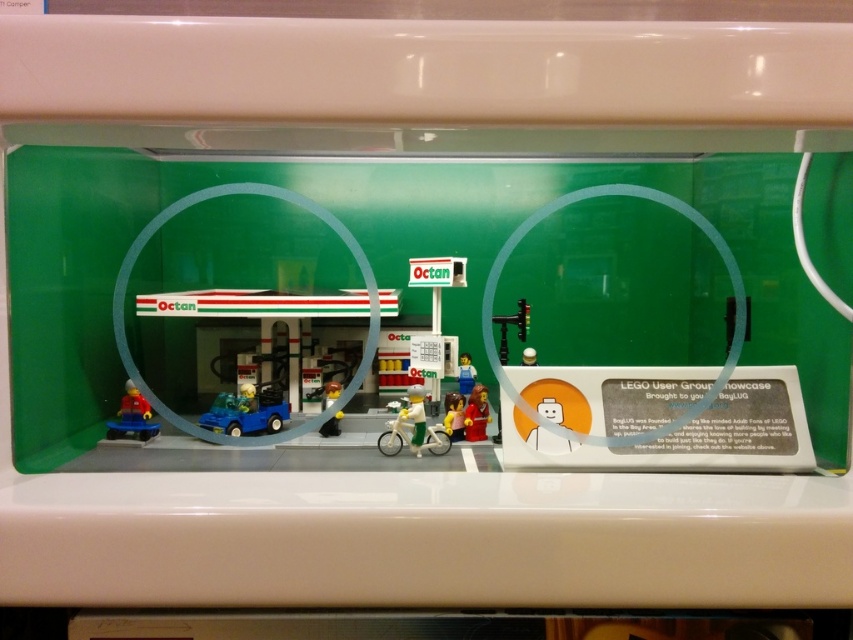
You are a LEGO collector examining the Octan gas station diorama. You notice two figures at the center of the scene. Which figure is taller between the smooth red figure at center and the smooth plastic figure at center?

The smooth red figure at center is taller than the smooth plastic figure at center.

You are a customer at the Octan gas station in the LEGO diorama. You want to place your LEGO wallet on the counter. Can you reach the white glossy counter top at lower center from the smooth plastic figure at center?

The white glossy counter top at lower center is taller than the smooth plastic figure at center, so the customer cannot reach the counter from the smooth plastic figure at center.